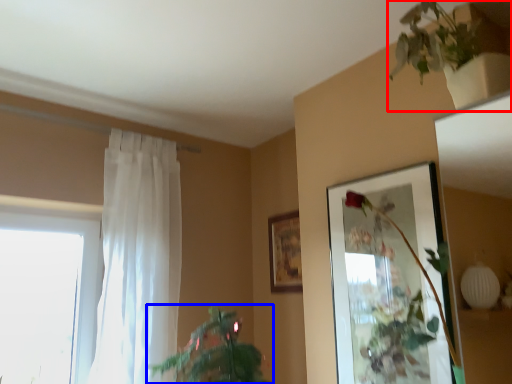
Question: Among these objects, which one is farthest to the camera, houseplant (highlighted by a red box) or houseplant (highlighted by a blue box)?

Choices:
 (A) houseplant
 (B) houseplant

Answer: (B)